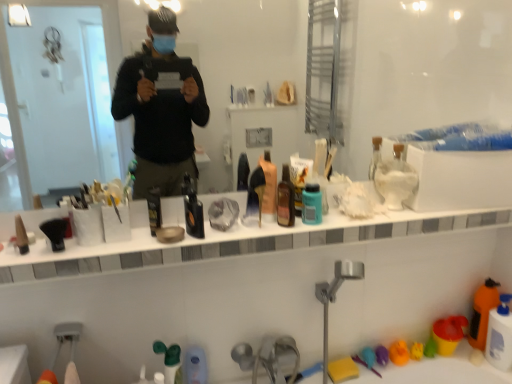
Identify the location of empty space that is ontop of white glossy counter top at center (from a real-world perspective). Image resolution: width=512 pixels, height=384 pixels. (262, 228).